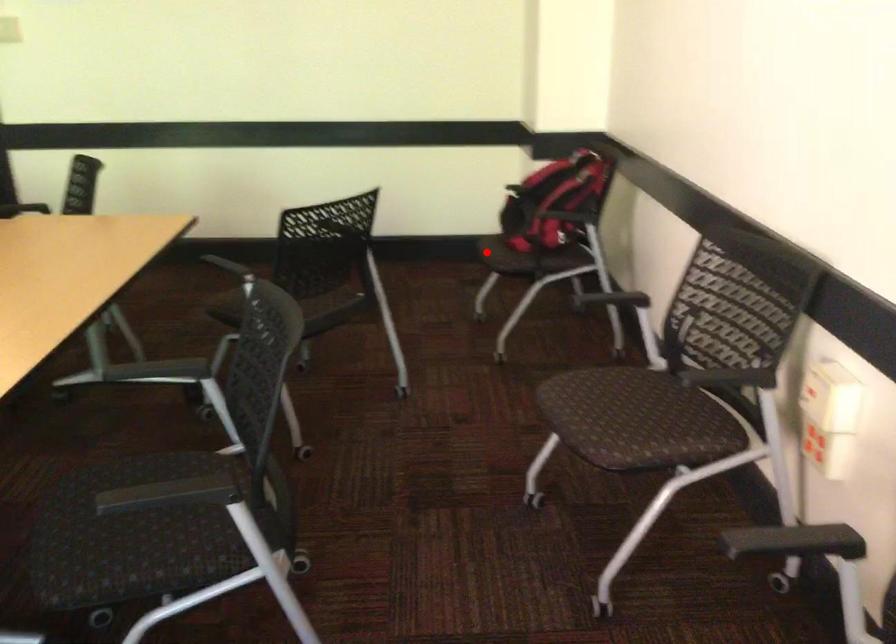
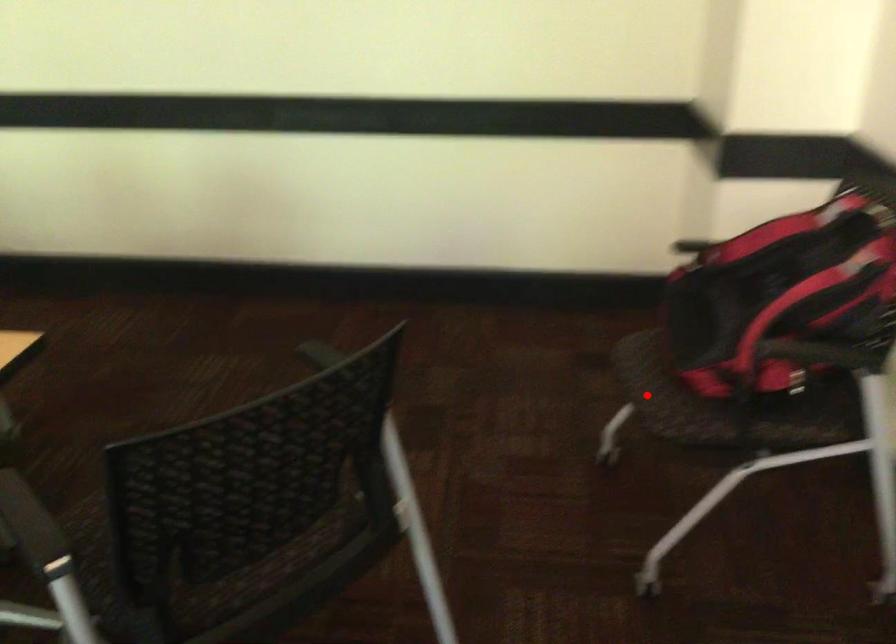
I am providing you with two images of the same scene from different viewpoints. A red point is marked on the first image and another point is marked on the second image. Is the red point in image1 aligned with the point shown in image2?

Yes